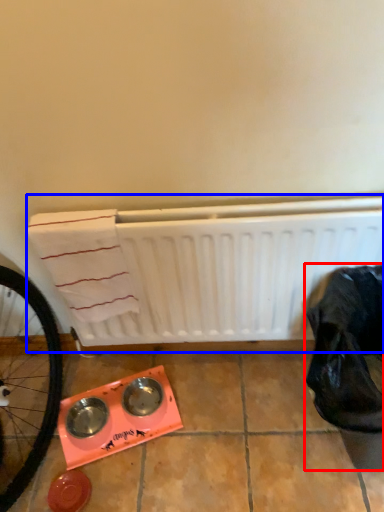
Question: Which of the following is the closest to the observer, waste (highlighted by a red box) or water heater (highlighted by a blue box)?

Choices:
 (A) waste
 (B) water heater

Answer: (A)